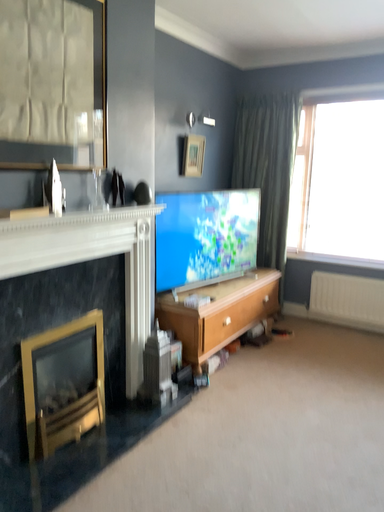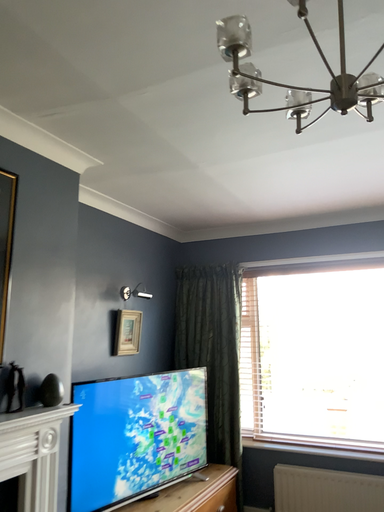
Question: How did the camera likely rotate when shooting the video?

Choices:
 (A) rotated downward
 (B) rotated upward

Answer: (B)